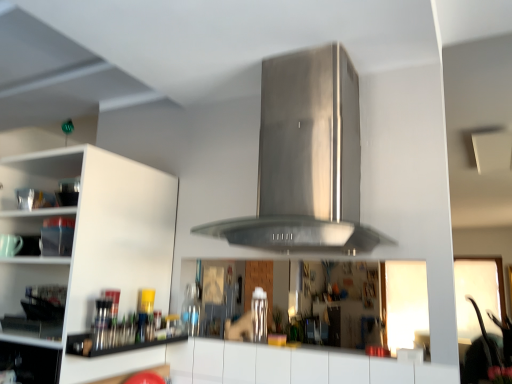
Question: Is metallic silver utensils at lower left closer to camera compared to white matte cabinet at left?

Choices:
 (A) yes
 (B) no

Answer: (B)

Question: Does metallic silver utensils at lower left appear on the left side of white matte cabinet at left?

Choices:
 (A) yes
 (B) no

Answer: (B)

Question: Is metallic silver utensils at lower left surrounding white matte cabinet at left?

Choices:
 (A) yes
 (B) no

Answer: (B)

Question: Is metallic silver utensils at lower left behind white matte cabinet at left?

Choices:
 (A) no
 (B) yes

Answer: (B)

Question: Is metallic silver utensils at lower left looking in the opposite direction of white matte cabinet at left?

Choices:
 (A) no
 (B) yes

Answer: (B)

Question: From a real-world perspective, does metallic silver utensils at lower left stand above white matte cabinet at left?

Choices:
 (A) no
 (B) yes

Answer: (A)

Question: Considering the relative sizes of stainless steel vent at center and white matte cabinet at left in the image provided, is stainless steel vent at center thinner than white matte cabinet at left?

Choices:
 (A) yes
 (B) no

Answer: (A)

Question: Is white matte cabinet at left at the back of stainless steel vent at center?

Choices:
 (A) yes
 (B) no

Answer: (B)

Question: Does stainless steel vent at center come in front of white matte cabinet at left?

Choices:
 (A) no
 (B) yes

Answer: (B)

Question: Is stainless steel vent at center to the left of white matte cabinet at left from the viewer's perspective?

Choices:
 (A) no
 (B) yes

Answer: (A)

Question: Is stainless steel vent at center positioned behind white matte cabinet at left?

Choices:
 (A) no
 (B) yes

Answer: (A)

Question: Is stainless steel vent at center far from white matte cabinet at left?

Choices:
 (A) yes
 (B) no

Answer: (B)

Question: Could you tell me if metallic silver utensils at lower left is turned towards stainless steel vent at center?

Choices:
 (A) no
 (B) yes

Answer: (A)